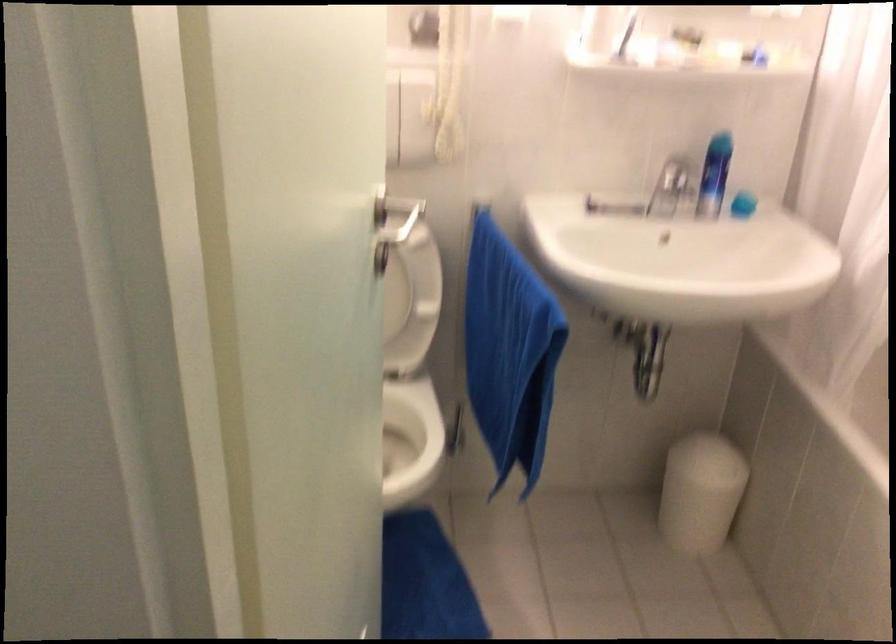
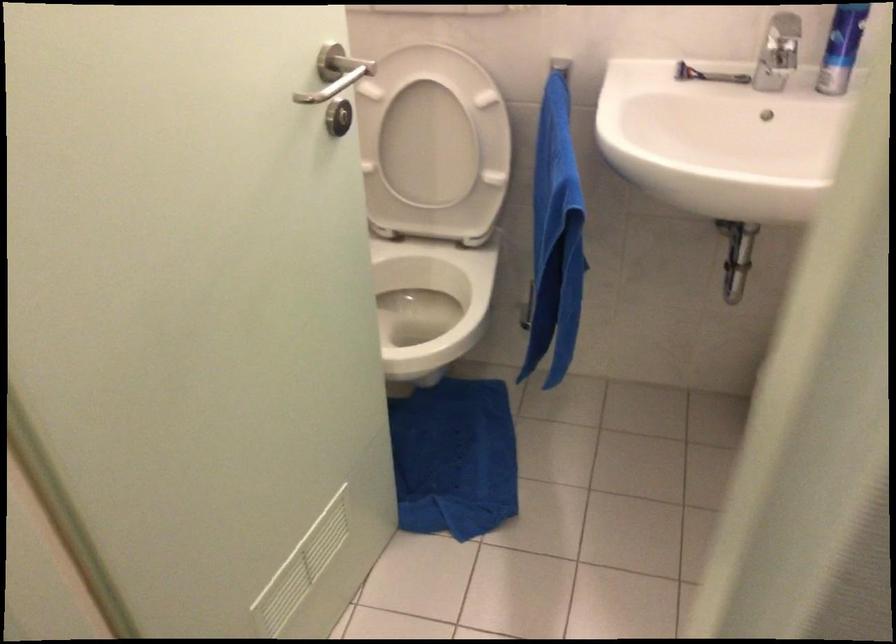
The point at (x=531, y=355) is marked in the first image. Where is the corresponding point in the second image?

(555, 238)